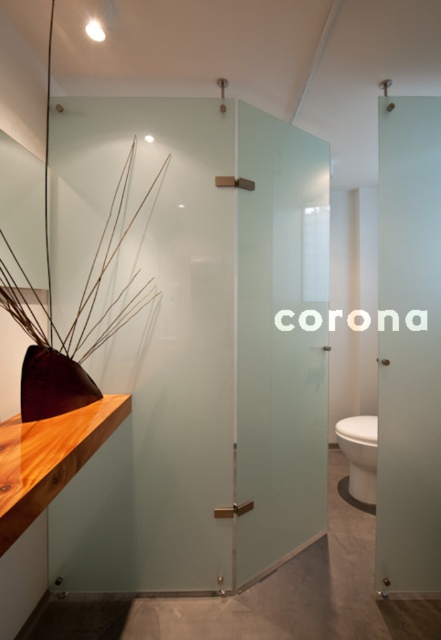
Question: Among these points, which one is farthest from the camera?

Choices:
 (A) (440, 564)
 (B) (265, 406)

Answer: (B)

Question: Among these points, which one is farthest from the camera?

Choices:
 (A) (350, 460)
 (B) (261, 442)

Answer: (A)

Question: Is frosted glass screen door at center smaller than satin glass screen door at right?

Choices:
 (A) no
 (B) yes

Answer: (A)

Question: Which point appears farthest from the camera in this image?

Choices:
 (A) (266, 316)
 (B) (355, 476)

Answer: (B)

Question: Is frosted glass screen door at center smaller than white glossy toilet bowl at lower right?

Choices:
 (A) yes
 (B) no

Answer: (B)

Question: Is satin glass screen door at right positioned in front of white glossy toilet bowl at lower right?

Choices:
 (A) no
 (B) yes

Answer: (B)